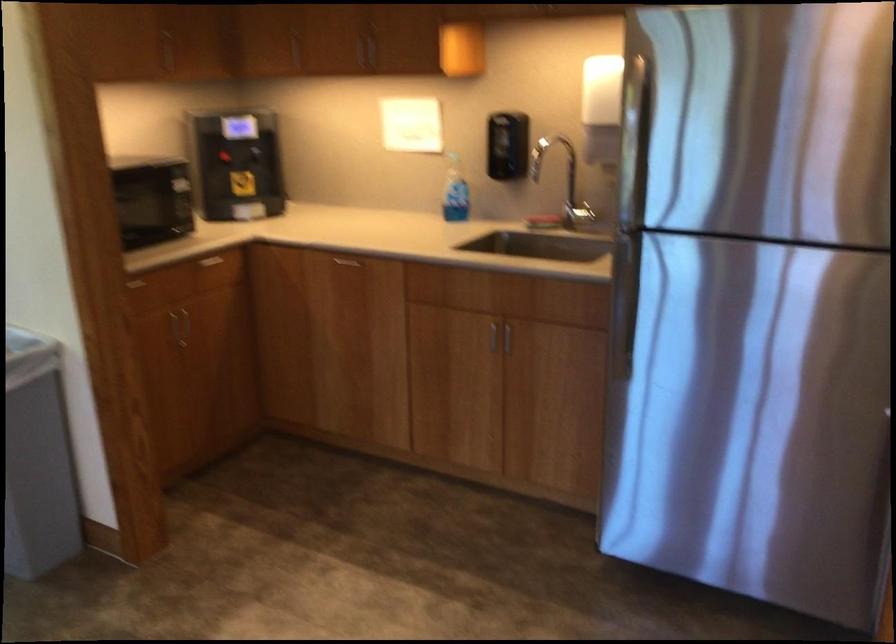
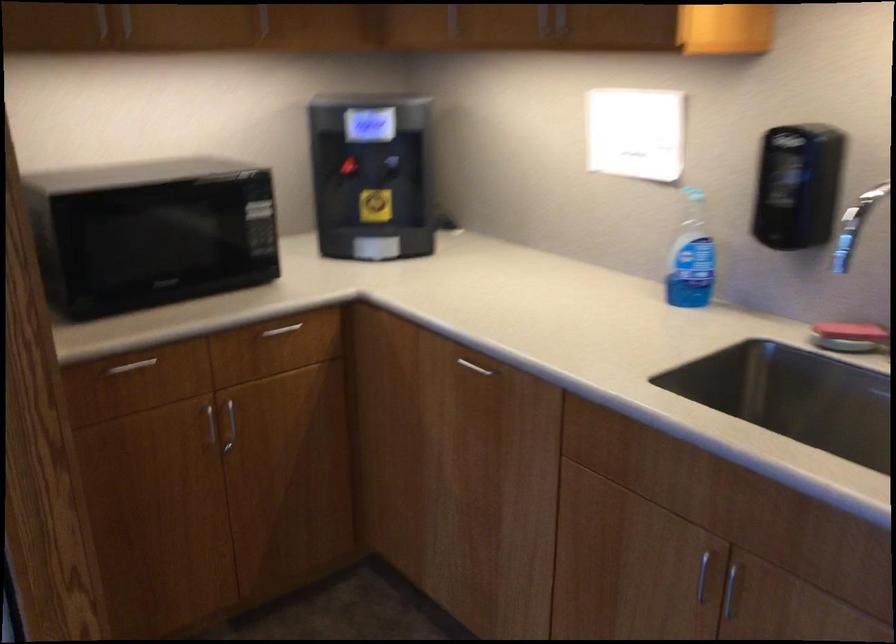
Where in the second image is the point corresponding to point (342, 261) from the first image?

(475, 366)